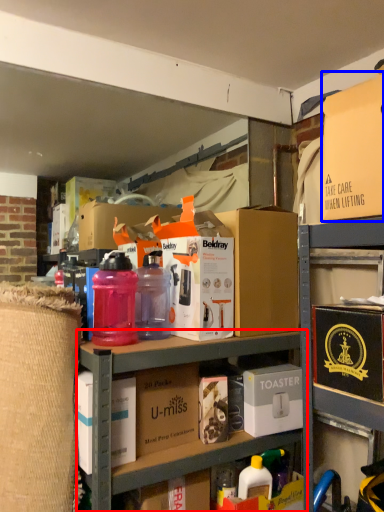
Question: Which object appears closest to the camera in this image, shelf (highlighted by a red box) or box (highlighted by a blue box)?

Choices:
 (A) shelf
 (B) box

Answer: (B)